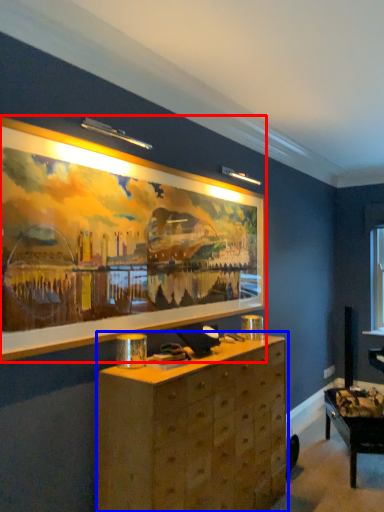
Question: Which point is closer to the camera, picture frame (highlighted by a red box) or chest of drawers (highlighted by a blue box)?

Choices:
 (A) picture frame
 (B) chest of drawers

Answer: (A)